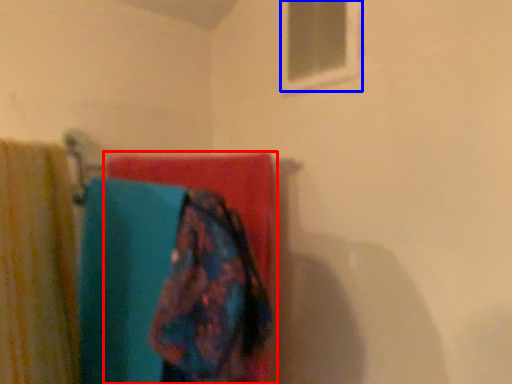
Question: Which object is closer to the camera taking this photo, towel (highlighted by a red box) or window (highlighted by a blue box)?

Choices:
 (A) towel
 (B) window

Answer: (A)